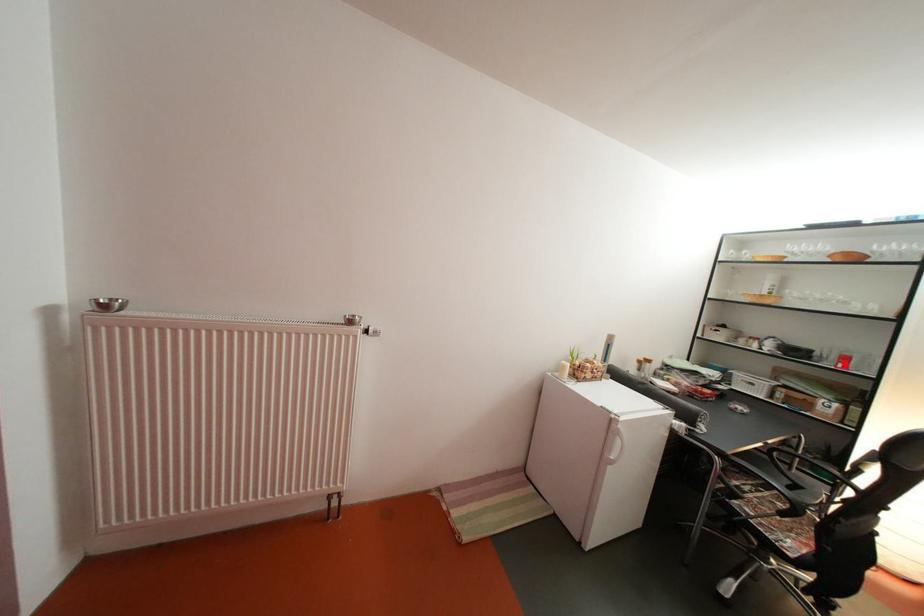
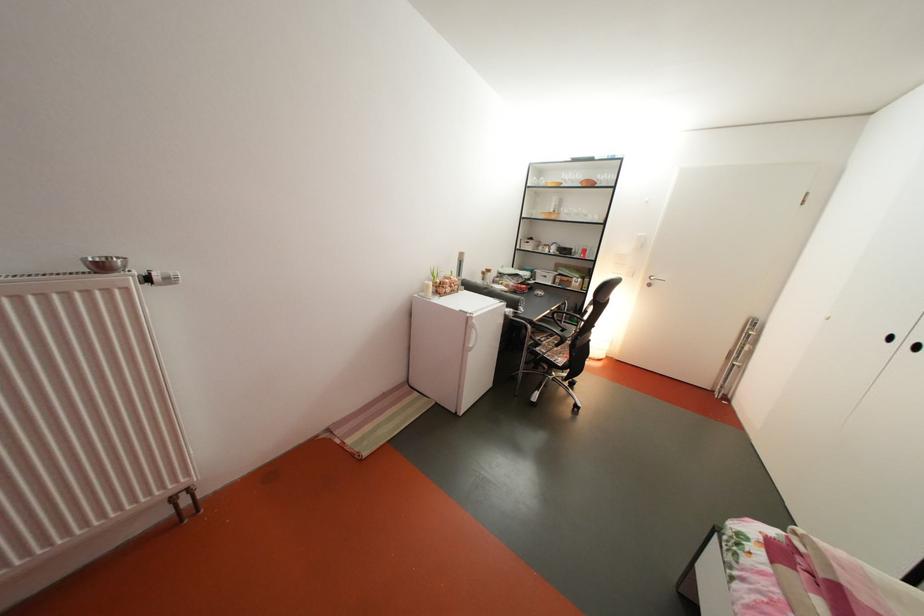
Find the pixel in the second image that matches the highlighted location in the first image.

(591, 257)